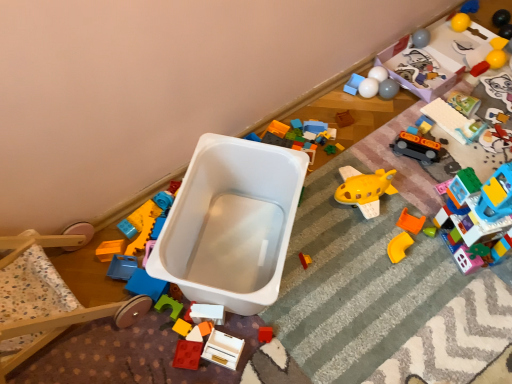
This screenshot has height=384, width=512. I want to click on vacant area located to the right-hand side of white plastic toy at center, the 14th toy when ordered from right to left, so click(x=274, y=322).